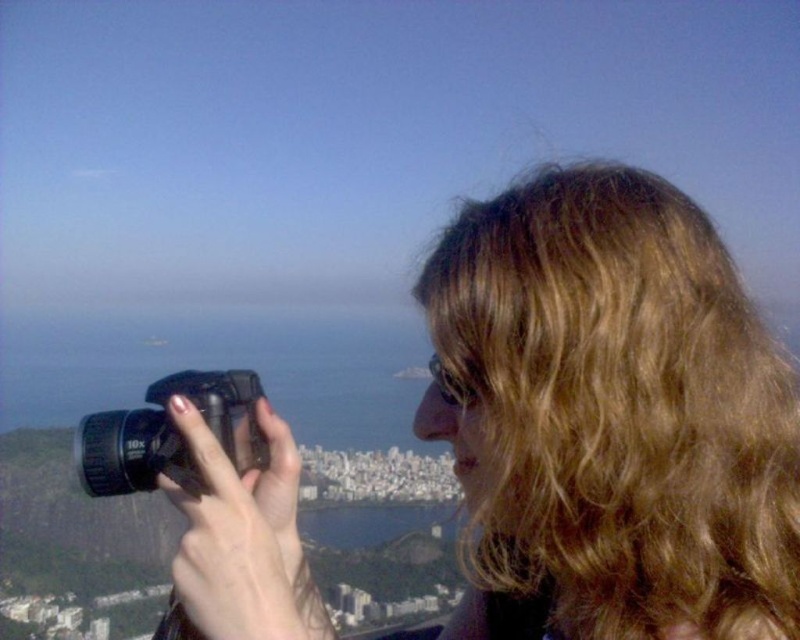
Question: Which point is farther to the camera?

Choices:
 (A) black plastic camera at center
 (B) blonde curly hair at upper right

Answer: (A)

Question: Can you confirm if blonde curly hair at upper right is thinner than black plastic camera at center?

Choices:
 (A) yes
 (B) no

Answer: (B)

Question: Is blonde curly hair at upper right to the right of black plastic camera at center from the viewer's perspective?

Choices:
 (A) yes
 (B) no

Answer: (A)

Question: Can you confirm if blonde curly hair at upper right is bigger than black plastic camera at center?

Choices:
 (A) yes
 (B) no

Answer: (A)